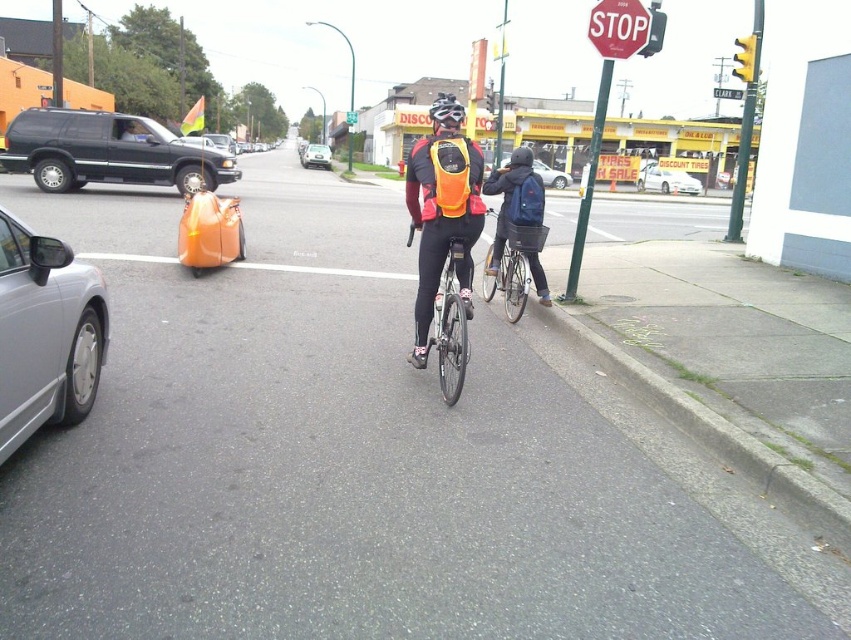
Question: Is matte black suv at left bigger than metallic silver car at center?

Choices:
 (A) no
 (B) yes

Answer: (A)

Question: Does silver metallic car at left appear on the right side of black matte bicycle helmet at center?

Choices:
 (A) no
 (B) yes

Answer: (A)

Question: Which is nearer to the white glossy sedan at center?

Choices:
 (A) silver metallic car at left
 (B) shiny metallic bicycle at center

Answer: (B)

Question: Which of the following is the closest to the observer?

Choices:
 (A) green plastic traffic sign at upper center
 (B) matte black suv at left

Answer: (B)

Question: Is metallic silver bicycle at center positioned behind high-visibility fabric safety vest at center?

Choices:
 (A) yes
 (B) no

Answer: (A)

Question: Which point is closer to the camera?

Choices:
 (A) (230, 160)
 (B) (453, 202)
 (C) (443, 173)
 (D) (418, 276)

Answer: (C)